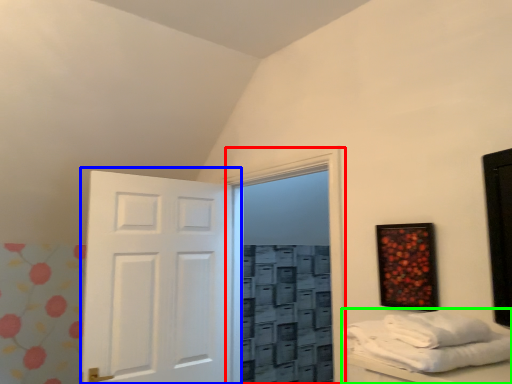
Question: Which object is positioned closest to glass door (highlighted by a red box)? Select from door (highlighted by a blue box) and furniture (highlighted by a green box).

Choices:
 (A) door
 (B) furniture

Answer: (A)